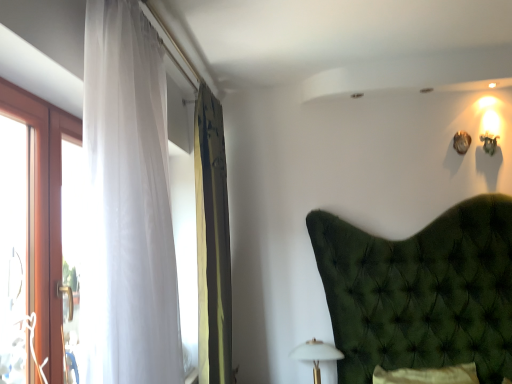
Question: Is white matte table lamp at lower center inside the boundaries of green textured curtain at left, the second curtain positioned from the front, or outside?

Choices:
 (A) inside
 (B) outside

Answer: (B)

Question: Is white matte table lamp at lower center in front of or behind green textured curtain at left, arranged as the first curtain when viewed from the back, in the image?

Choices:
 (A) behind
 (B) front

Answer: (A)

Question: Based on their relative distances, which object is nearer to the green textured curtain at left, the second curtain positioned from the front?

Choices:
 (A) translucent white curtain at left, the first curtain when ordered from front to back
 (B) white matte table lamp at lower center

Answer: (B)

Question: Which of these objects is positioned closest to the translucent white curtain at left, the first curtain when ordered from front to back?

Choices:
 (A) green textured curtain at left, the second curtain positioned from the front
 (B) white matte table lamp at lower center

Answer: (A)